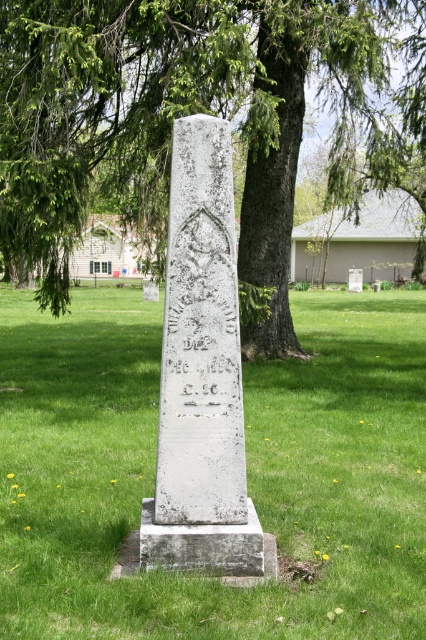
You are a gardener who needs to plant a new tree in the cemetery. You see the green leafy tree at center and the white stone monument at center. Which object is bigger and should you consider its space when planning?

The green leafy tree at center has a larger size compared to the white stone monument at center, so you should consider its space when planning.

You are a visitor at the cemetery and want to take a photo of the white stone monument at center without the green leafy tree at center blocking it. How should you position yourself relative to the tree?

The white stone monument at center is behind the green leafy tree at center, so you should move behind the green leafy tree at center to take a photo of the monument without obstruction.